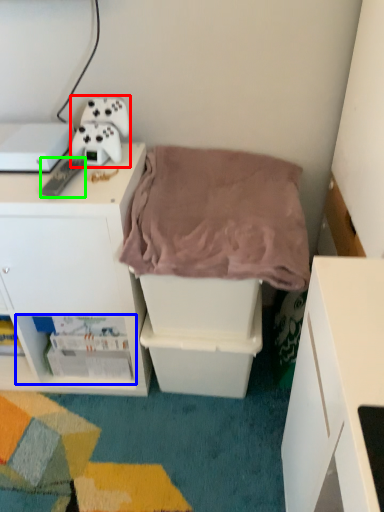
Question: Based on their relative distances, which object is farther from equipment (highlighted by a red box)? Choose from shelf (highlighted by a blue box) and remote control (highlighted by a green box).

Choices:
 (A) shelf
 (B) remote control

Answer: (A)